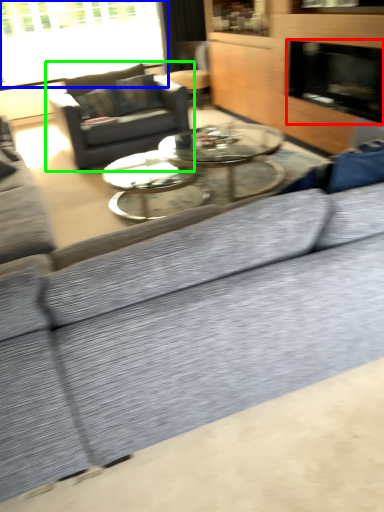
Question: Estimate the real-world distances between objects in this image. Which object is closer to fireplace (highlighted by a red box), window (highlighted by a blue box) or studio couch (highlighted by a green box)?

Choices:
 (A) window
 (B) studio couch

Answer: (B)